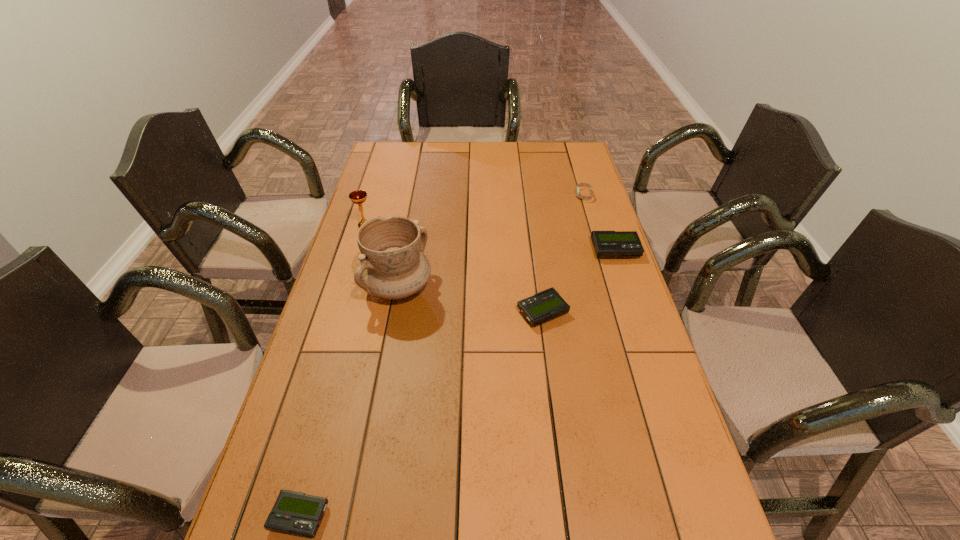
Please point a spot to place another beeper for symmetrical spacing. Please provide its 2D coordinates. Your answer should be formatted as a tuple, i.e. [(x, y)], where the tuple contains the x and y coordinates of a point satisfying the conditions above.

[(444, 396)]